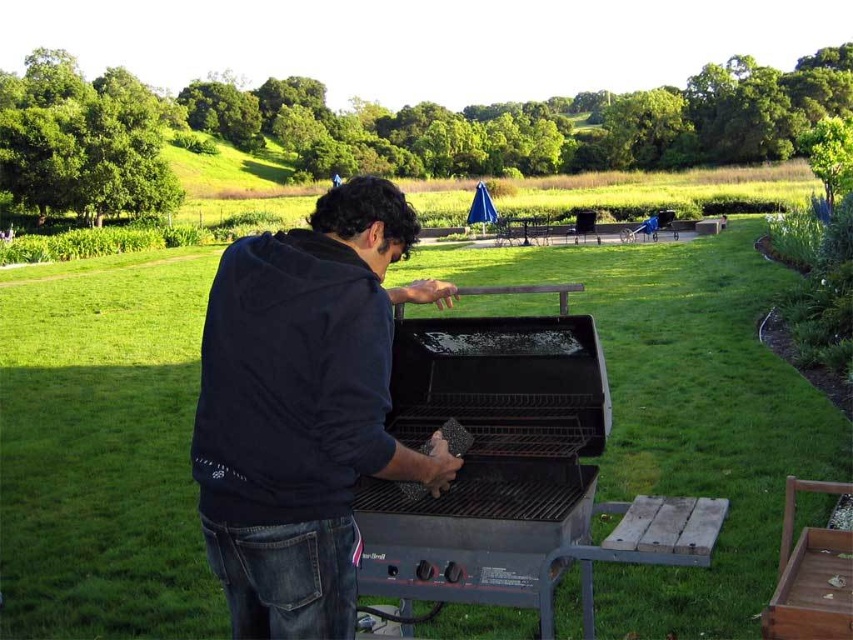
You are a guest at a barbecue party and see the dark blue hoodie at center and the black matte barbecue grill at center. Which item is located to the right of the other?

The black matte barbecue grill at center is located to the right of the dark blue hoodie at center because the dark blue hoodie at center is positioned on the left side of it.

You are a visitor in the park and see the dark blue hoodie at center and the black matte barbecue grill at center. Which object is taller?

The dark blue hoodie at center is much taller than the black matte barbecue grill at center.